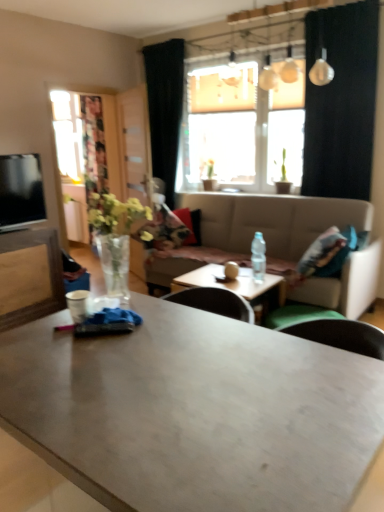
Question: Does point (44, 245) appear closer or farther from the camera than point (254, 288)?

Choices:
 (A) farther
 (B) closer

Answer: (A)

Question: In terms of height, does wooden entertainment center at left look taller or shorter compared to wooden table at center, the second coffee table from the front?

Choices:
 (A) tall
 (B) short

Answer: (A)

Question: Which of these objects is positioned closest to the green matte plant at upper center?

Choices:
 (A) black fabric curtain at upper right, which is the first curtain from front to back
 (B) translucent glass window at center
 (C) matte black television at left
 (D) clear glass vase at left
 (E) black fabric curtain at upper center, which is counted as the first curtain, starting from the left

Answer: (B)

Question: Considering the real-world distances, which object is farthest from the transparent glass door at left?

Choices:
 (A) black fabric curtain at upper right, the 2th curtain when ordered from left to right
 (B) matte black television at left
 (C) wooden entertainment center at left
 (D) green matte plant at upper center
 (E) clear glass vase at left

Answer: (E)